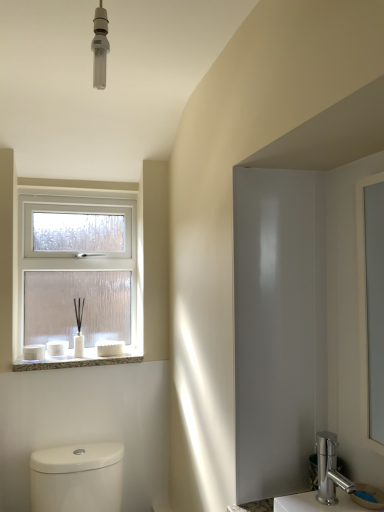
Find the location of a particular element. The image size is (384, 512). free space above clear glass window at upper left (from a real-world perspective) is located at coordinates (78, 188).